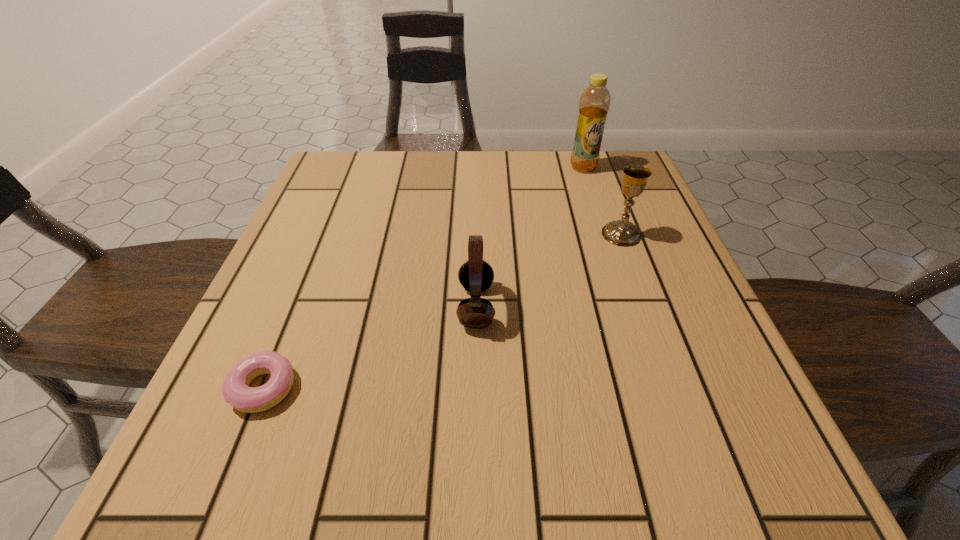
Locate an element on the screen. The width and height of the screenshot is (960, 540). the farthest object is located at coordinates (594, 103).

At what (x,y) coordinates should I click in order to perform the action: click on the tallest object. Please return your answer as a coordinate pair (x, y). The image size is (960, 540). Looking at the image, I should click on (594, 103).

Image resolution: width=960 pixels, height=540 pixels. Identify the location of the third nearest object. (622, 232).

You are a GUI agent. You are given a task and a screenshot of the screen. Output one action in this format:
    pyautogui.click(x=<x>, y=<y>)
    Task: Click on the third object from right to left
    Image resolution: width=960 pixels, height=540 pixels.
    Given the screenshot: What is the action you would take?
    pyautogui.click(x=475, y=275)

In order to click on the third farthest object in this screenshot , I will do `click(475, 275)`.

At what (x,y) coordinates should I click in order to perform the action: click on the leftmost object. Please return your answer as a coordinate pair (x, y). This screenshot has width=960, height=540. Looking at the image, I should click on (236, 391).

Identify the location of doughnut. This screenshot has height=540, width=960. (236, 391).

Locate an element on the screen. Image resolution: width=960 pixels, height=540 pixels. free space located on the left of the farthest object is located at coordinates (445, 167).

Identify the location of vacant space located 0.350m on the left of the chalice. (431, 234).

Image resolution: width=960 pixels, height=540 pixels. Identify the location of vacant space located on the ear pads of the third farthest object. (627, 306).